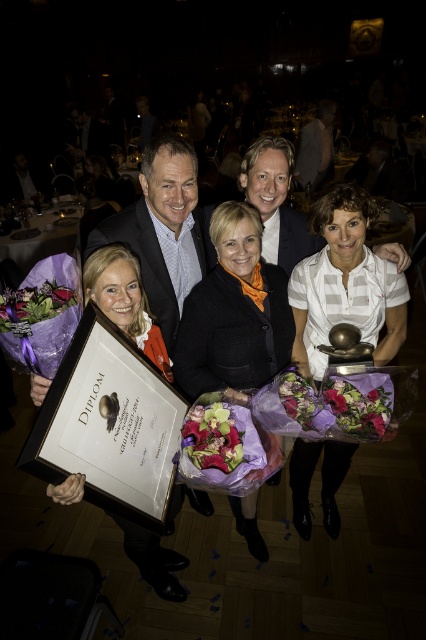
You are standing at the point marked as point [193,436] in the banquet hall. You want to hand a gift to a colleague who is exactly 1.5 meters away from you. Can you reach them without moving?

The distance between you and the viewer is 1.51 meters, so you are slightly farther than 1.5 meters. Therefore, you cannot reach them without moving.

You are a photographer at the event and want to take a closeup of the point at coordinates point (57, 296) and point (299, 381). Which point should you focus on to capture more detail?

Point (57, 296) is closer to the camera than point (299, 381), so focusing on point (57, 296) will allow you to capture more detail.